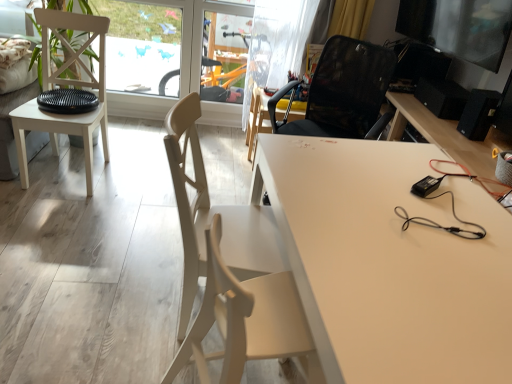
Question: Could you tell me if black matte speaker at right is facing transparent plastic screen door at upper center?

Choices:
 (A) no
 (B) yes

Answer: (A)

Question: Is black matte speaker at right at the left side of transparent plastic screen door at upper center?

Choices:
 (A) no
 (B) yes

Answer: (A)

Question: Can you confirm if black matte speaker at right is shorter than transparent plastic screen door at upper center?

Choices:
 (A) no
 (B) yes

Answer: (B)

Question: Can you confirm if black matte speaker at right is smaller than transparent plastic screen door at upper center?

Choices:
 (A) no
 (B) yes

Answer: (B)

Question: Is transparent plastic screen door at upper center located within black matte speaker at right?

Choices:
 (A) no
 (B) yes

Answer: (A)

Question: Is point coord(487,34) positioned closer to the camera than point coord(231,119)?

Choices:
 (A) farther
 (B) closer

Answer: (B)

Question: Is metallic glossy monitor at upper right to the left or to the right of transparent plastic screen door at upper center in the image?

Choices:
 (A) right
 (B) left

Answer: (A)

Question: Is metallic glossy monitor at upper right wider or thinner than transparent plastic screen door at upper center?

Choices:
 (A) thin
 (B) wide

Answer: (B)

Question: Would you say metallic glossy monitor at upper right is inside or outside transparent plastic screen door at upper center?

Choices:
 (A) inside
 (B) outside

Answer: (B)

Question: Is black mesh chair at center, placed as the 4th chair when sorted from front to back, situated inside transparent plastic screen door at upper center or outside?

Choices:
 (A) inside
 (B) outside

Answer: (B)

Question: Based on their positions, is black mesh chair at center, which appears as the first chair when viewed from the back, located to the left or right of transparent plastic screen door at upper center?

Choices:
 (A) left
 (B) right

Answer: (B)

Question: In the image, is black mesh chair at center, placed as the 4th chair when sorted from front to back, positioned in front of or behind transparent plastic screen door at upper center?

Choices:
 (A) behind
 (B) front

Answer: (B)

Question: Considering the positions of black mesh chair at center, placed as the 4th chair when sorted from front to back, and transparent plastic screen door at upper center in the image, is black mesh chair at center, placed as the 4th chair when sorted from front to back, wider or thinner than transparent plastic screen door at upper center?

Choices:
 (A) wide
 (B) thin

Answer: (A)

Question: From their relative heights in the image, would you say white matte desk at center is taller or shorter than white matte chair at left, which is the second chair from back to front?

Choices:
 (A) short
 (B) tall

Answer: (A)

Question: In terms of size, does white matte desk at center appear bigger or smaller than white matte chair at left, which appears as the third chair when viewed from the front?

Choices:
 (A) small
 (B) big

Answer: (B)